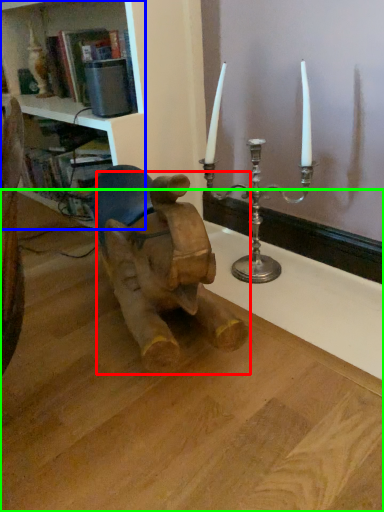
Question: Which is farther away from baby elephant (highlighted by a red box)? shelf (highlighted by a blue box) or table (highlighted by a green box)?

Choices:
 (A) shelf
 (B) table

Answer: (A)